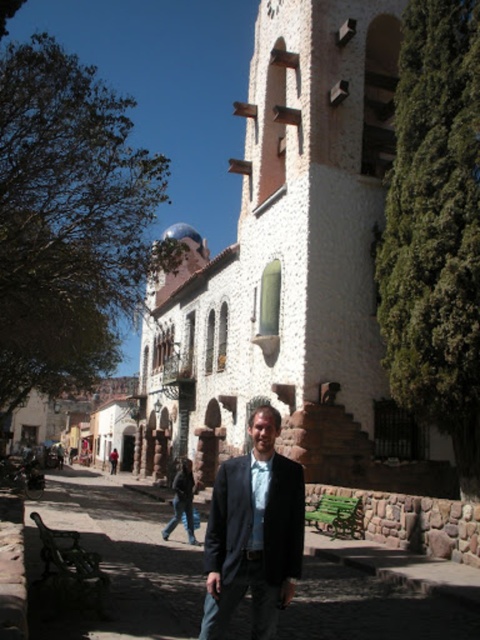
You are a photographer positioned on the cobblestone street wanting to capture both the white stucco church at center and the matte black suit at center in your shot. Based on their positions, which object should you adjust your camera to focus on first to ensure both are in frame?

The white stucco church at center is to the left of the matte black suit at center, so you should focus on the white stucco church at center first to ensure both are included in the frame.

You are a photographer positioned at point 0.0, 0.0 in the coordinate system of the image. You want to capture a photo of the matte black suit at center located at point (253, 532). What direction should you move to get closer to the matte black suit at center?

To get closer to the matte black suit at center at point (253, 532), you should move in the direction of increasing both the x and y coordinates from your current position at 0.0, 0.0.